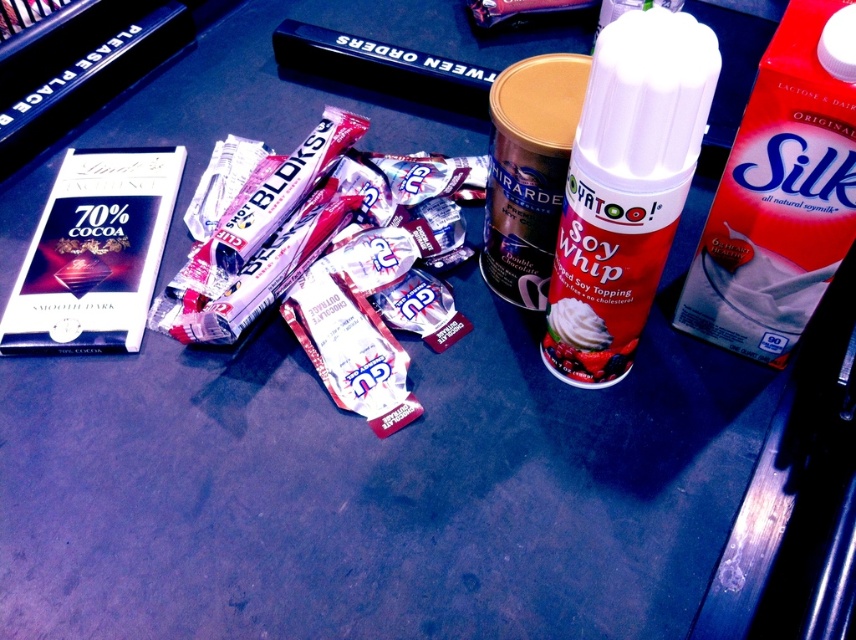
Question: Is red matte soy whip can at center positioned before metallic gold canister at center?

Choices:
 (A) no
 (B) yes

Answer: (B)

Question: Which point is farther from the camera taking this photo?

Choices:
 (A) (519, 276)
 (B) (812, 122)
 (C) (595, 170)

Answer: (A)

Question: Which point is farther to the camera?

Choices:
 (A) red matte soy whip can at center
 (B) metallic gold canister at center
 (C) red cardboard carton at right

Answer: (B)

Question: Is red cardboard carton at right positioned behind red matte soy whip can at center?

Choices:
 (A) no
 (B) yes

Answer: (B)

Question: Estimate the real-world distances between objects in this image. Which object is closer to the metallic gold canister at center?

Choices:
 (A) red matte soy whip can at center
 (B) red cardboard carton at right

Answer: (A)

Question: Considering the relative positions of red cardboard carton at right and metallic gold canister at center in the image provided, where is red cardboard carton at right located with respect to metallic gold canister at center?

Choices:
 (A) above
 (B) below

Answer: (B)